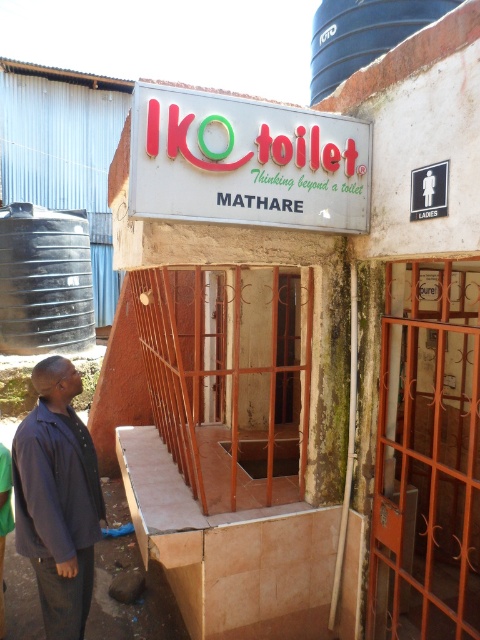
Question: Estimate the real-world distances between objects in this image. Which object is farther from the dark blue shirt at lower left?

Choices:
 (A) black plastic water tank at upper left
 (B) blue plastic silo at upper center

Answer: (A)

Question: Which of the following is the farthest from the observer?

Choices:
 (A) (312, 33)
 (B) (90, 285)

Answer: (B)

Question: Does dark blue shirt at lower left appear over black plastic water tank at upper left?

Choices:
 (A) no
 (B) yes

Answer: (A)

Question: Does dark blue shirt at lower left appear over blue plastic silo at upper center?

Choices:
 (A) no
 (B) yes

Answer: (A)

Question: Which point is farther from the camera taking this photo?

Choices:
 (A) (59, 580)
 (B) (323, 81)

Answer: (B)

Question: Is dark blue shirt at lower left positioned before blue plastic silo at upper center?

Choices:
 (A) no
 (B) yes

Answer: (B)